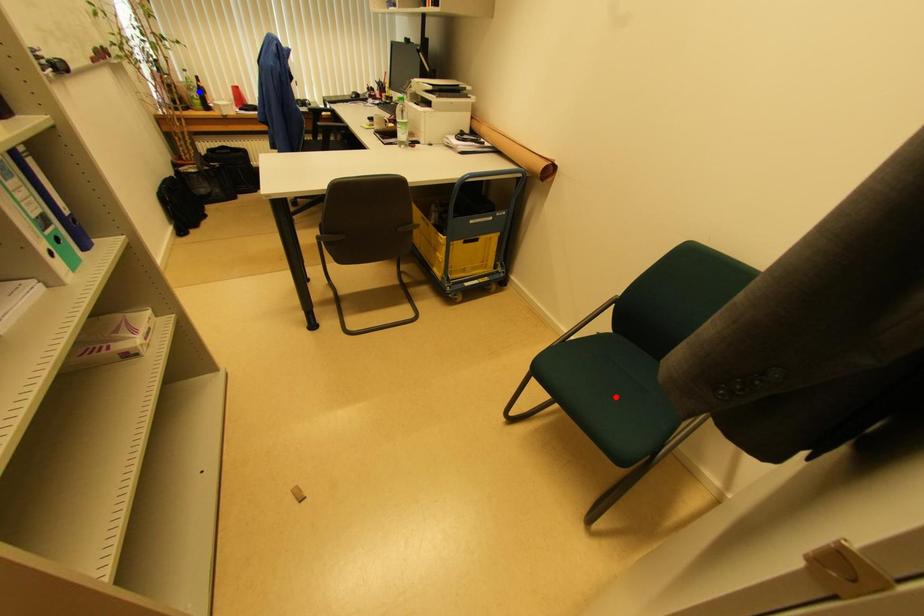
Question: In the image, two points are highlighted. Which point is nearer to the camera? Reply with the corresponding letter.

Choices:
 (A) blue point
 (B) red point

Answer: (B)